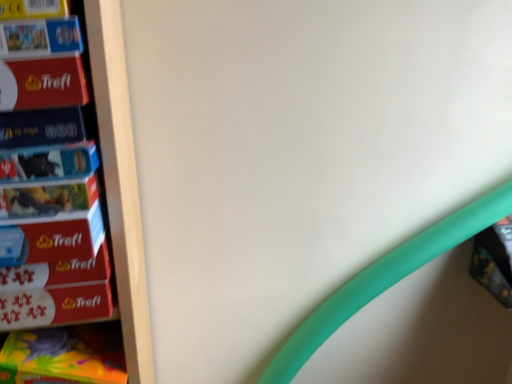
Question: Looking at their shapes, would you say matte plastic book at right, marked as the 2th book in a top-to-bottom arrangement, is wider or thinner than matte cardboard book at left, the second paperback book positioned from the top?

Choices:
 (A) wide
 (B) thin

Answer: (B)

Question: In terms of height, does matte plastic book at right, which is the 1th book in bottom-to-top order, look taller or shorter compared to matte cardboard book at left, the second paperback book in the bottom-to-top sequence?

Choices:
 (A) tall
 (B) short

Answer: (A)

Question: Estimate the real-world distances between objects in this image. Which object is closer to the matte red puzzle box at left, the 1th paperback book from the top?

Choices:
 (A) matte black book at left, which is the 1th paperback book in bottom-to-top order
 (B) matte plastic book at right, which is the second book in left-to-right order
 (C) matte cardboard book at upper left, the 1th book in the left-to-right sequence
 (D) matte cardboard book at left, the second paperback book positioned from the top

Answer: (C)

Question: Estimate the real-world distances between objects in this image. Which object is closer to the matte plastic book at right, the 1th book viewed from the right?

Choices:
 (A) matte cardboard book at upper left, the 1th book viewed from the top
 (B) matte black book at left, which is the 1th paperback book in bottom-to-top order
 (C) matte red puzzle box at left, positioned as the third paperback book in bottom-to-top order
 (D) matte cardboard book at left, the second paperback book positioned from the top

Answer: (B)